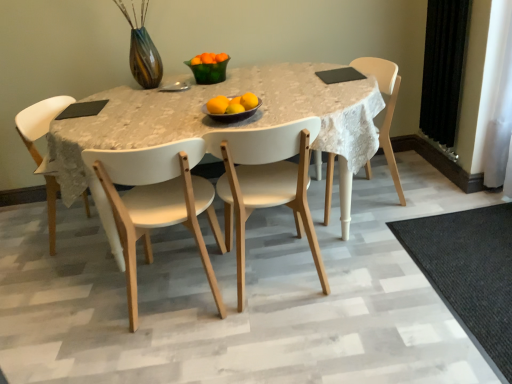
Question: From the image's perspective, is white matte chair at center, which ranks as the 3th chair in right-to-left order, below white matte table at center?

Choices:
 (A) no
 (B) yes

Answer: (B)

Question: Is white matte chair at center, the second chair in the left-to-right sequence, oriented away from white matte table at center?

Choices:
 (A) no
 (B) yes

Answer: (B)

Question: Can you confirm if white matte chair at center, the second chair in the left-to-right sequence, is thinner than white matte table at center?

Choices:
 (A) no
 (B) yes

Answer: (B)

Question: Is white matte chair at center, which ranks as the 3th chair in right-to-left order, taller than white matte table at center?

Choices:
 (A) no
 (B) yes

Answer: (B)

Question: Is white matte chair at center, which ranks as the 3th chair in right-to-left order, not within white matte table at center?

Choices:
 (A) yes
 (B) no

Answer: (B)

Question: Relative to yellow matte/orange at center, acting as the 2th orange starting from the front, is black velvet curtain at right in front or behind?

Choices:
 (A) front
 (B) behind

Answer: (B)

Question: Considering the positions of black velvet curtain at right and yellow matte/orange at center, acting as the 2th orange starting from the front, in the image, is black velvet curtain at right bigger or smaller than yellow matte/orange at center, acting as the 2th orange starting from the front,?

Choices:
 (A) big
 (B) small

Answer: (A)

Question: Considering the positions of black velvet curtain at right and yellow matte/orange at center, which is the sixth orange in top-to-bottom order, in the image, is black velvet curtain at right taller or shorter than yellow matte/orange at center, which is the sixth orange in top-to-bottom order,?

Choices:
 (A) tall
 (B) short

Answer: (A)

Question: In terms of width, does black velvet curtain at right look wider or thinner when compared to yellow matte/orange at center, which is the sixth orange in top-to-bottom order?

Choices:
 (A) wide
 (B) thin

Answer: (A)

Question: Considering the positions of yellow matte/orange at center, the 1th orange positioned from the bottom, and white matte table at center in the image, is yellow matte/orange at center, the 1th orange positioned from the bottom, taller or shorter than white matte table at center?

Choices:
 (A) short
 (B) tall

Answer: (A)

Question: Looking at their shapes, would you say yellow matte/orange at center, which appears as the fifth orange when viewed from the back, is wider or thinner than white matte table at center?

Choices:
 (A) wide
 (B) thin

Answer: (B)

Question: In the image, is yellow matte/orange at center, which appears as the fifth orange when viewed from the back, positioned in front of or behind white matte table at center?

Choices:
 (A) front
 (B) behind

Answer: (B)

Question: Is point (230, 104) closer or farther from the camera than point (145, 102)?

Choices:
 (A) closer
 (B) farther

Answer: (A)

Question: Is white matte chair at center, the second chair in the left-to-right sequence, in front of or behind yellow matte/orange at center, which appears as the fifth orange when viewed from the back, in the image?

Choices:
 (A) front
 (B) behind

Answer: (A)

Question: Is white matte chair at center, the second chair in the left-to-right sequence, inside the boundaries of yellow matte/orange at center, acting as the 2th orange starting from the front, or outside?

Choices:
 (A) inside
 (B) outside

Answer: (B)